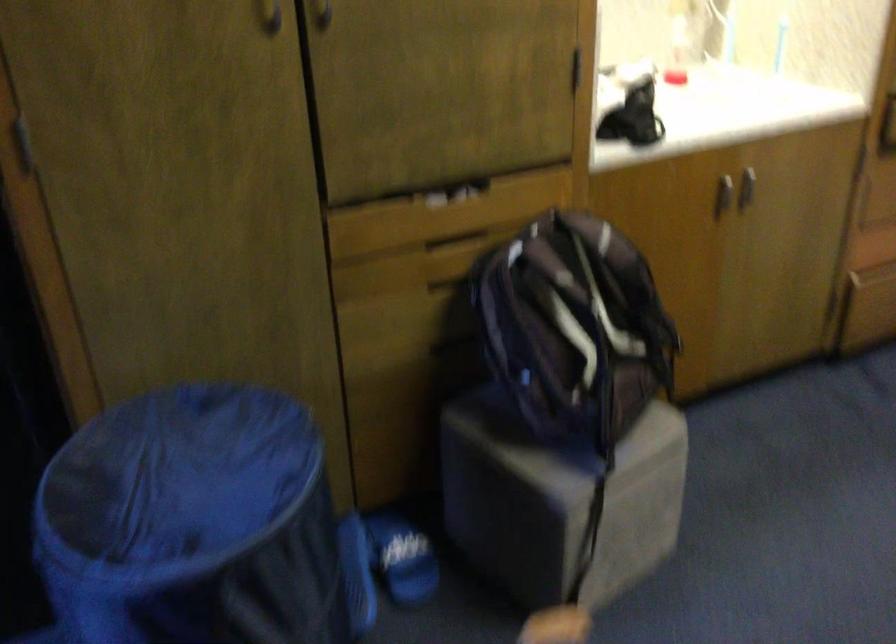
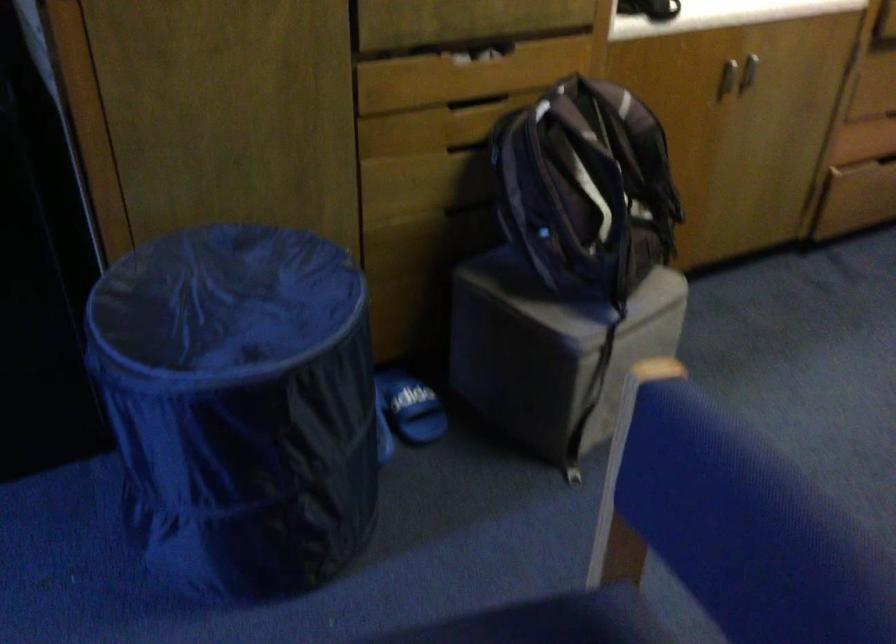
Find the pixel in the second image that matches the point at 453,285 in the first image.

(471, 144)